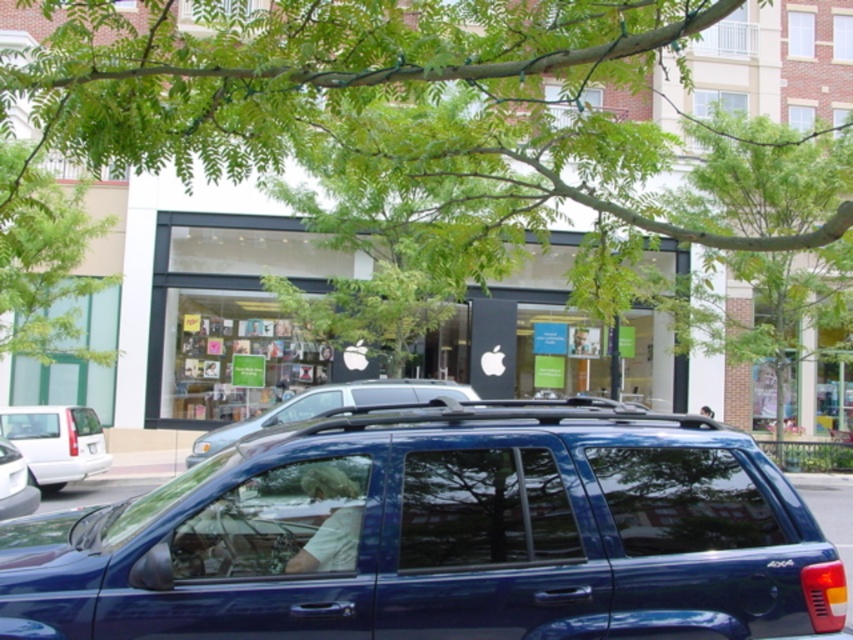
Question: Which of the following is the farthest from the observer?

Choices:
 (A) (370, 10)
 (B) (22, 506)

Answer: (B)

Question: Does glossy blue minivan at center have a lesser width compared to white plastic license plate at center?

Choices:
 (A) yes
 (B) no

Answer: (B)

Question: Which point is closer to the camera taking this photo?

Choices:
 (A) (682, 362)
 (B) (99, 445)

Answer: (B)

Question: Which of the following is the farthest from the observer?

Choices:
 (A) (231, 108)
 (B) (9, 490)

Answer: (B)

Question: Observing the image, what is the correct spatial positioning of glossy blue minivan at center in reference to matte glass storefront at center?

Choices:
 (A) above
 (B) below

Answer: (B)

Question: Does matte glass storefront at center appear on the left side of metallic blue suv at center?

Choices:
 (A) yes
 (B) no

Answer: (B)